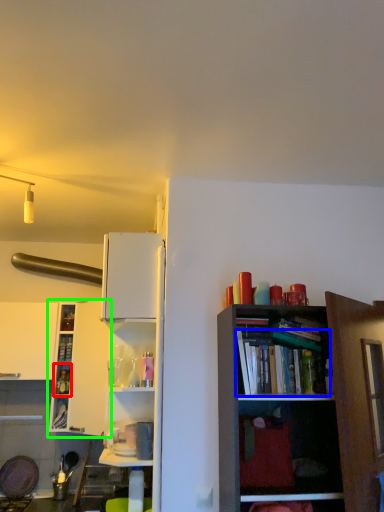
Question: Based on their relative distances, which object is farther from cabinet (highlighted by a red box)? Choose from book (highlighted by a blue box) and shelf (highlighted by a green box).

Choices:
 (A) book
 (B) shelf

Answer: (A)